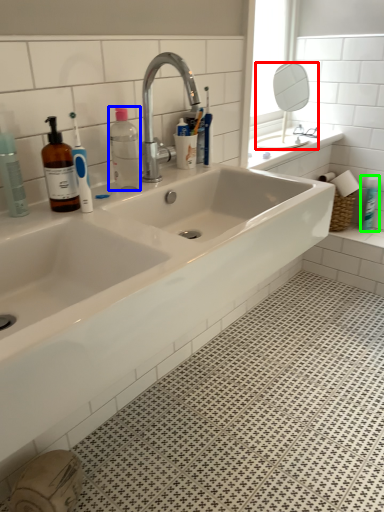
Question: Which object is the farthest from mirror (highlighted by a red box)? Choose among these: bottle (highlighted by a blue box) or toiletry (highlighted by a green box).

Choices:
 (A) bottle
 (B) toiletry

Answer: (A)